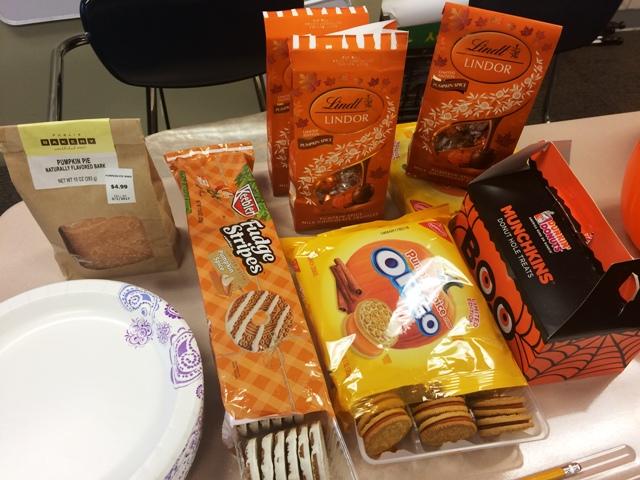
Where is `paper plate`? The height and width of the screenshot is (480, 640). paper plate is located at coordinates (102, 395).